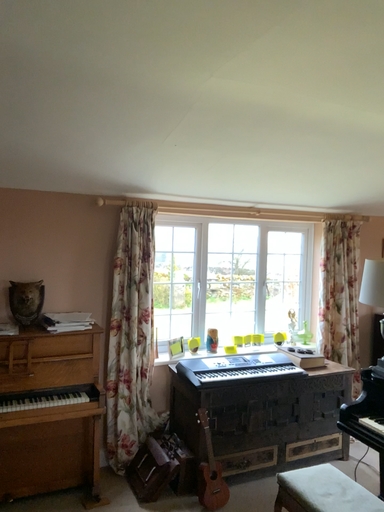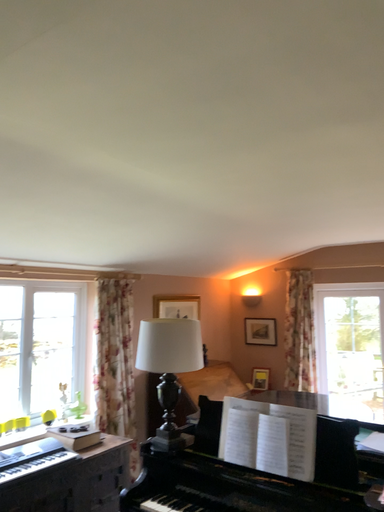
Question: Which way did the camera rotate in the video?

Choices:
 (A) rotated left
 (B) rotated right

Answer: (B)